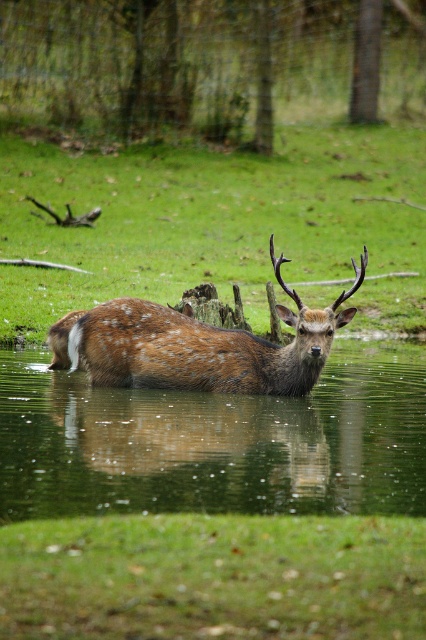
Which of these two, brown textured grass at center or fawn fur antlered deer at center, stands shorter?

Standing shorter between the two is fawn fur antlered deer at center.

Is brown textured grass at center taller than fawn fur antlered deer at center?

Indeed, brown textured grass at center has a greater height compared to fawn fur antlered deer at center.

What do you see at coordinates (216, 225) in the screenshot?
I see `brown textured grass at center` at bounding box center [216, 225].

This screenshot has width=426, height=640. In order to click on brown textured grass at center in this screenshot , I will do `click(216, 225)`.